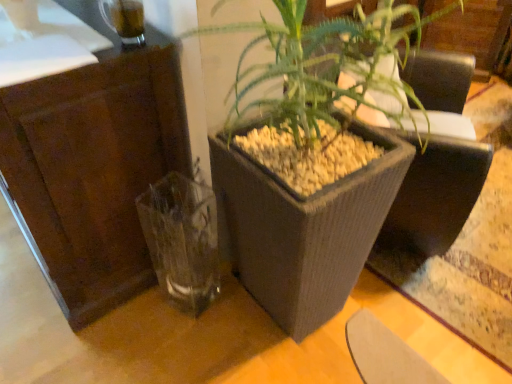
Find the location of a particular element. Image resolution: width=512 pixels, height=384 pixels. free spot below transparent glass vase at lower left (from a real-world perspective) is located at coordinates (181, 311).